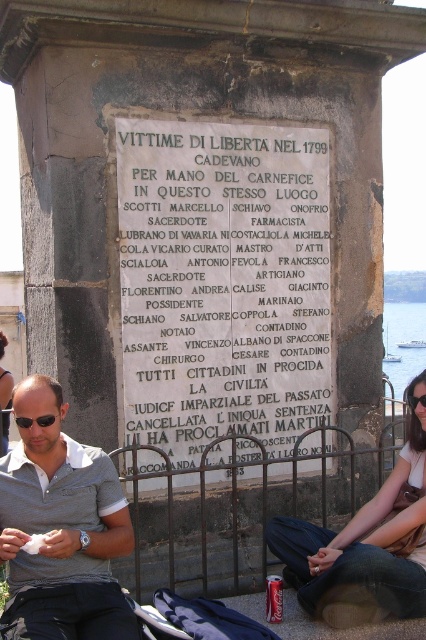
Question: Estimate the real-world distances between objects in this image. Which object is farther from the gray polo shirt at center?

Choices:
 (A) blue water at lower right
 (B) denim jeans at lower right
 (C) white stone plaque at center

Answer: (A)

Question: Does gray polo shirt at center appear on the left side of black plastic sunglasses at lower left?

Choices:
 (A) yes
 (B) no

Answer: (B)

Question: Which is farther from the gray polo shirt at center?

Choices:
 (A) black plastic sunglasses at lower left
 (B) white stone plaque at center

Answer: (B)

Question: Can you confirm if gray polo shirt at center is thinner than blue water at lower right?

Choices:
 (A) yes
 (B) no

Answer: (B)

Question: Can you confirm if white stone plaque at center is positioned above black plastic sunglasses at lower left?

Choices:
 (A) no
 (B) yes

Answer: (B)

Question: Which of the following is the farthest from the observer?

Choices:
 (A) black plastic sunglasses at lower left
 (B) blue water at lower right
 (C) white stone plaque at center
 (D) denim jeans at lower right

Answer: (B)